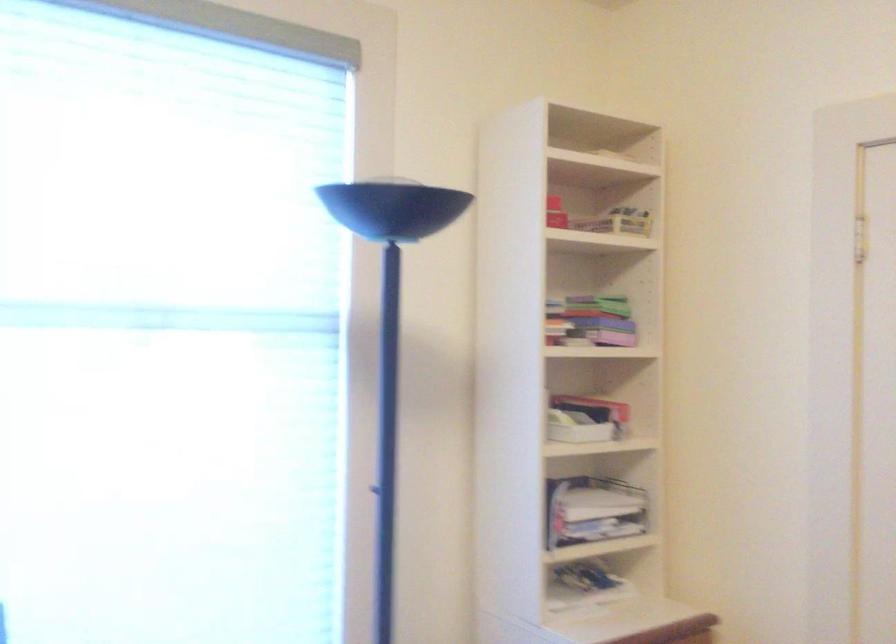
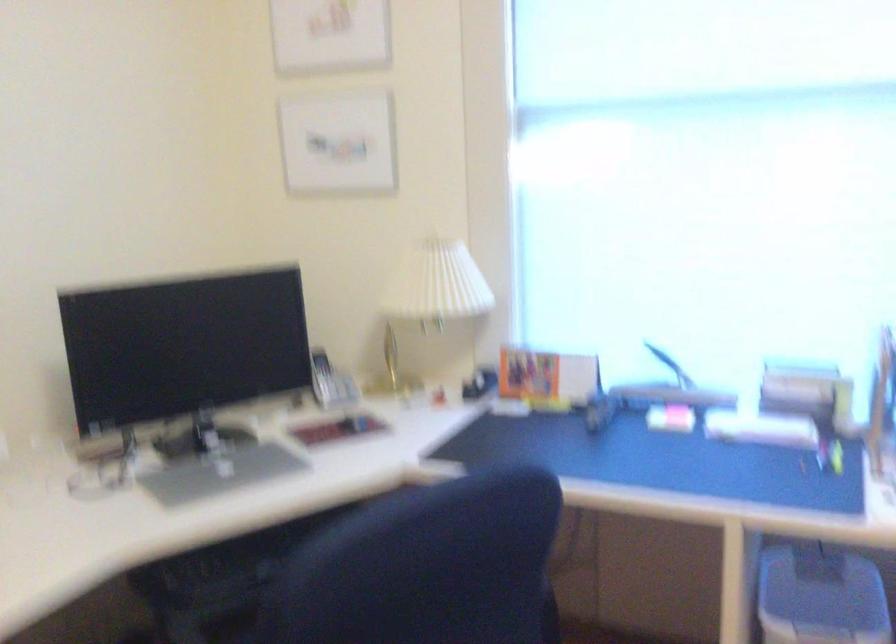
Question: Based on the continuous images, in which direction is the camera rotating? Reply with the corresponding letter.

Choices:
 (A) Left
 (B) Right
 (C) Up
 (D) Down

Answer: (A)